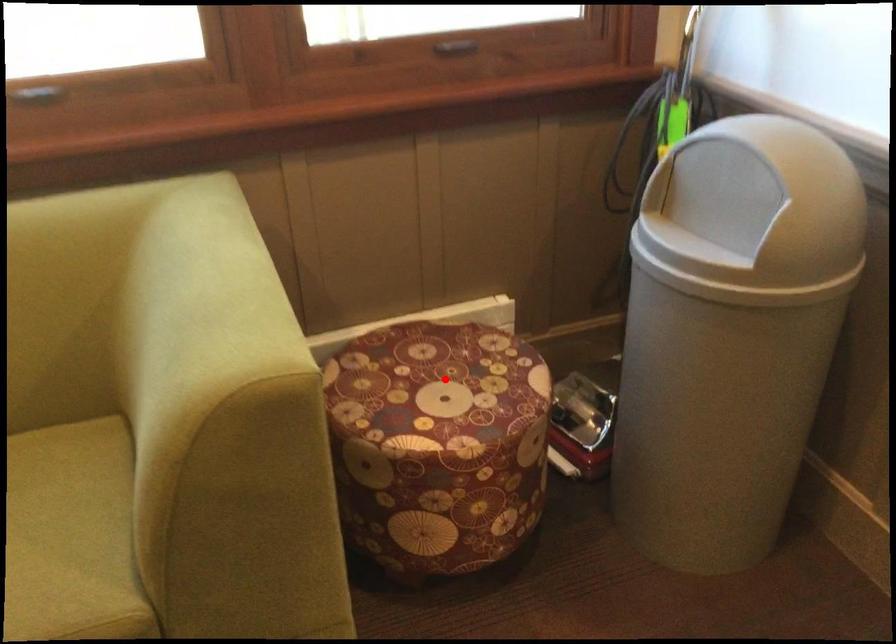
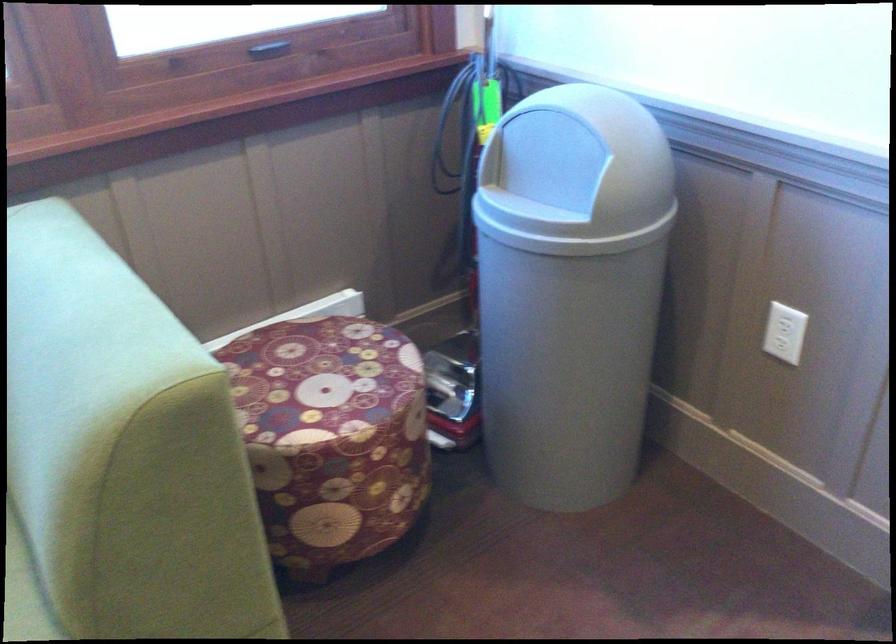
Find the pixel in the second image that matches the highlighted location in the first image.

(320, 373)